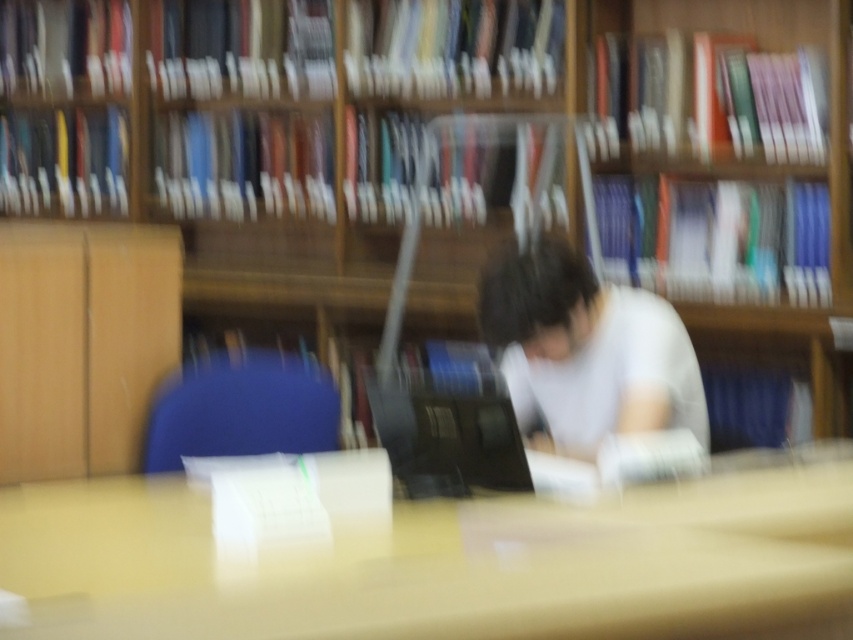
You are organizing a small meeting in the library and need to seat two people. You have a smooth wooden table at center and a white matte shirt at center available. Which object can accommodate a standard chair seat?

The smooth wooden table at center can accommodate a standard chair seat because tables are typically designed to hold chairs, whereas the white matte shirt at center is an article of clothing and not a surface.

You are organizing a small event in the library and need to place a 70 cm wide banner between the smooth wooden table at center and the white matte shirt at center. Can the banner fit between them?

The distance between the smooth wooden table at center and the white matte shirt at center is 69.52 centimeters. Since the banner is 70 cm wide, it is slightly too wide to fit comfortably between them.

You are a librarian organizing items in the library. You have a smooth wooden table at center and a white matte shirt at center. Which item is closer to the floor?

The smooth wooden table at center is closer to the floor since it is located below the white matte shirt at center.